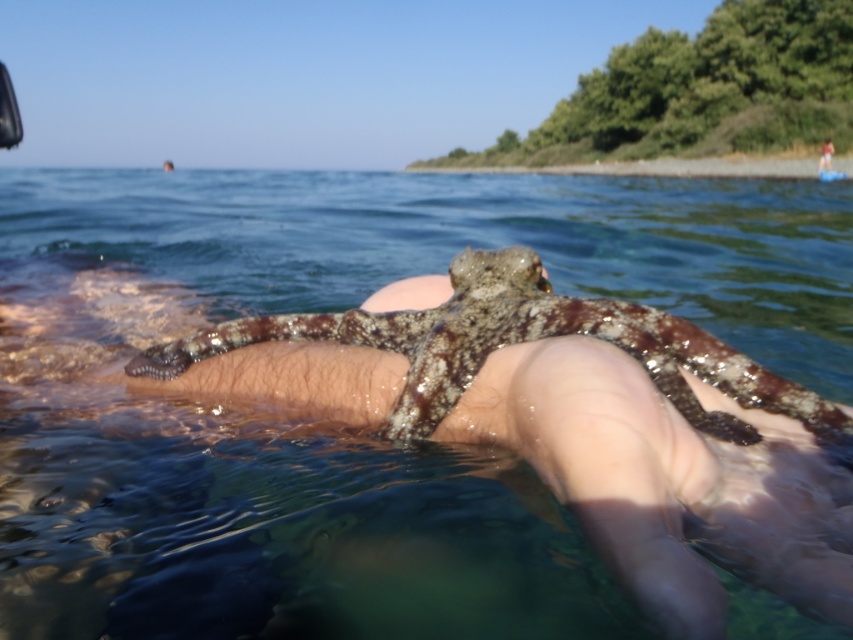
Locate an element on the screen. This screenshot has height=640, width=853. clear water at legs upper is located at coordinates (334, 435).

Who is taller, clear water at legs upper or smooth skin at upper center?

clear water at legs upper is taller.

Describe the element at coordinates (334, 435) in the screenshot. I see `clear water at legs upper` at that location.

At what (x,y) coordinates should I click in order to perform the action: click on clear water at legs upper. Please return your answer as a coordinate pair (x, y). This screenshot has height=640, width=853. Looking at the image, I should click on (334, 435).

In the scene shown: Which is more to the left, speckled skin octopus at center or smooth skin at upper center?

From the viewer's perspective, speckled skin octopus at center appears more on the left side.

Can you confirm if speckled skin octopus at center is positioned above smooth skin at upper center?

No, speckled skin octopus at center is not above smooth skin at upper center.

In order to click on speckled skin octopus at center in this screenshot , I will do coord(520,342).

Locate an element on the screen. This screenshot has height=640, width=853. speckled skin octopus at center is located at coordinates (520, 342).

Is clear water at legs upper behind speckled skin octopus at center?

No.

Based on the photo, does clear water at legs upper come in front of speckled skin octopus at center?

Yes.

This screenshot has height=640, width=853. Describe the element at coordinates (334, 435) in the screenshot. I see `clear water at legs upper` at that location.

At what (x,y) coordinates should I click in order to perform the action: click on clear water at legs upper. Please return your answer as a coordinate pair (x, y). This screenshot has width=853, height=640. Looking at the image, I should click on (334, 435).